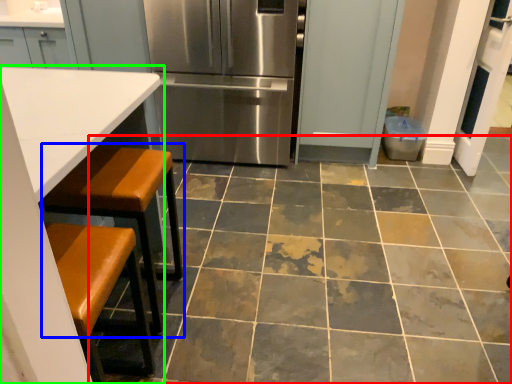
Question: Considering the real-world distances, which object is closest to ceramic tile (highlighted by a red box)? step stool (highlighted by a blue box) or table (highlighted by a green box).

Choices:
 (A) step stool
 (B) table

Answer: (A)